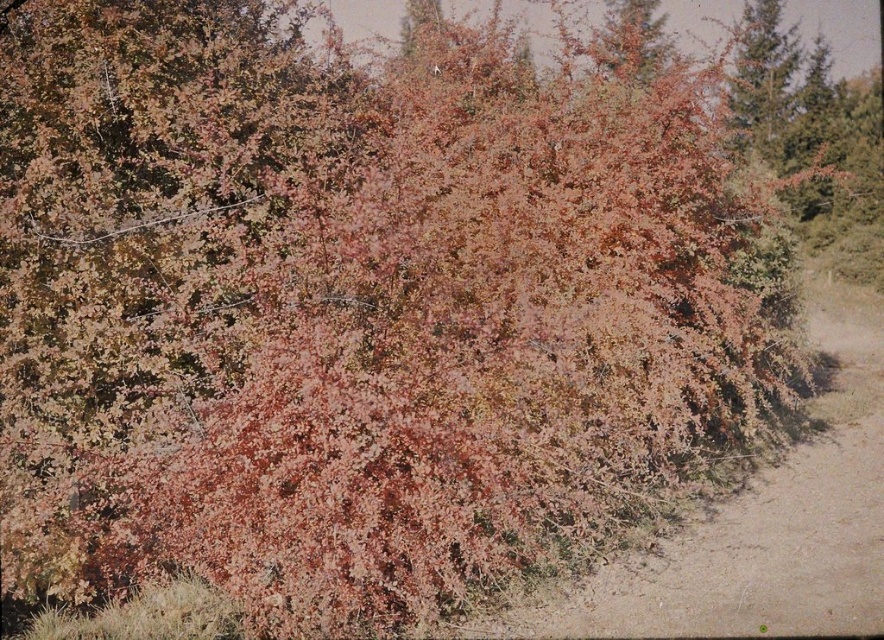
Can you confirm if brown sandy dirt track at lower right is wider than green textured tree at upper right?

Yes, brown sandy dirt track at lower right is wider than green textured tree at upper right.

Who is more distant from viewer, (850, 484) or (783, 84)?

The point (783, 84) is behind.

Between point (456, 625) and point (768, 67), which one is positioned behind?

The point (768, 67) is more distant.

I want to click on brown sandy dirt track at lower right, so click(755, 528).

Between point (832, 406) and point (631, 4), which one is positioned behind?

Point (631, 4)

Is brown sandy dirt track at lower right wider than leaves at upper right?

Indeed, brown sandy dirt track at lower right has a greater width compared to leaves at upper right.

Is point (817, 604) positioned in front of point (645, 51)?

Yes, point (817, 604) is closer to viewer.

At what (x,y) coordinates should I click in order to perform the action: click on brown sandy dirt track at lower right. Please return your answer as a coordinate pair (x, y). Looking at the image, I should click on (755, 528).

Is green textured tree at upper right above leaves at upper right?

Actually, green textured tree at upper right is below leaves at upper right.

Can you confirm if green textured tree at upper right is shorter than leaves at upper right?

No, green textured tree at upper right is not shorter than leaves at upper right.

The width and height of the screenshot is (884, 640). What do you see at coordinates (761, 74) in the screenshot?
I see `green textured tree at upper right` at bounding box center [761, 74].

This screenshot has height=640, width=884. I want to click on green textured tree at upper right, so click(761, 74).